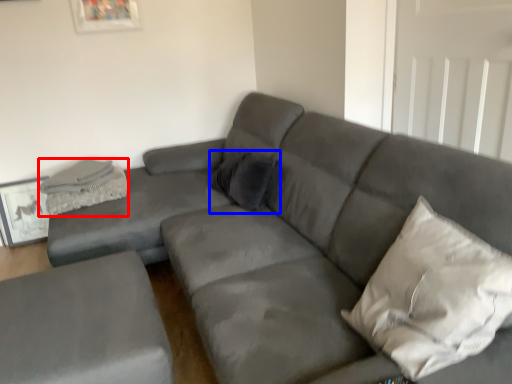
Question: Among these objects, which one is nearest to the camera, material (highlighted by a red box) or pillow (highlighted by a blue box)?

Choices:
 (A) material
 (B) pillow

Answer: (B)